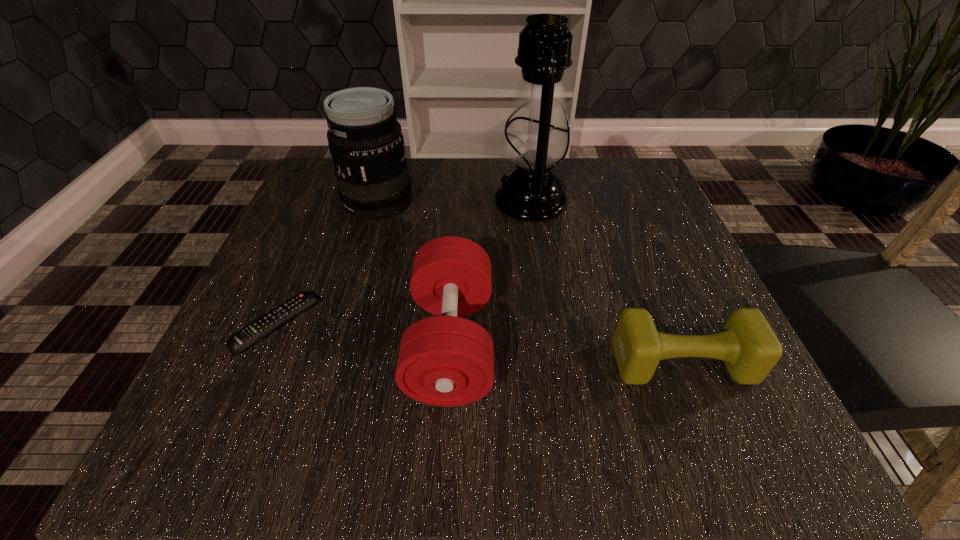
Identify the location of free space at the far edge of the desktop. (568, 212).

The height and width of the screenshot is (540, 960). Identify the location of vacant space at the near edge. (427, 409).

Image resolution: width=960 pixels, height=540 pixels. Identify the location of free space at the left edge of the desktop. (210, 367).

Identify the location of vacant space at the right edge of the desktop. (665, 227).

What are the coordinates of `free space at the far left corner` in the screenshot? It's located at (310, 184).

Locate an element on the screen. vacant region at the near left corner of the desktop is located at coordinates (246, 435).

Locate an element on the screen. Image resolution: width=960 pixels, height=540 pixels. free space at the far right corner of the desktop is located at coordinates (604, 199).

Find the location of a particular element. The height and width of the screenshot is (540, 960). vacant space at the near right corner of the desktop is located at coordinates (722, 426).

Find the location of `vacant area that lies between the remote control and the fourth object from left to right`. vacant area that lies between the remote control and the fourth object from left to right is located at coordinates (403, 262).

Where is `vacant region between the shortest object and the telephoto lens`? This screenshot has width=960, height=540. vacant region between the shortest object and the telephoto lens is located at coordinates (327, 263).